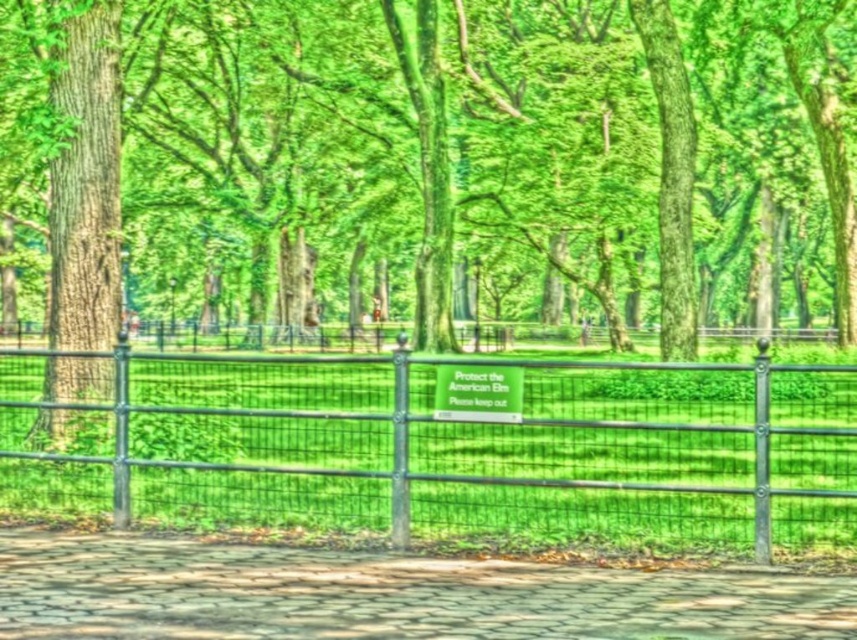
Question: Which object is the closest to the green leafy tree at center?

Choices:
 (A) paved stone path at lower center
 (B) green wire mesh fence at center

Answer: (B)

Question: Does green wire mesh fence at center come behind paved stone path at lower center?

Choices:
 (A) no
 (B) yes

Answer: (B)

Question: Estimate the real-world distances between objects in this image. Which object is closer to the paved stone path at lower center?

Choices:
 (A) green wire mesh fence at center
 (B) green leafy tree at center

Answer: (A)

Question: Is green wire mesh fence at center thinner than paved stone path at lower center?

Choices:
 (A) no
 (B) yes

Answer: (A)

Question: Which of the following is the farthest from the observer?

Choices:
 (A) paved stone path at lower center
 (B) green wire mesh fence at center
 (C) green leafy tree at center

Answer: (C)

Question: Does green wire mesh fence at center have a larger size compared to paved stone path at lower center?

Choices:
 (A) yes
 (B) no

Answer: (A)